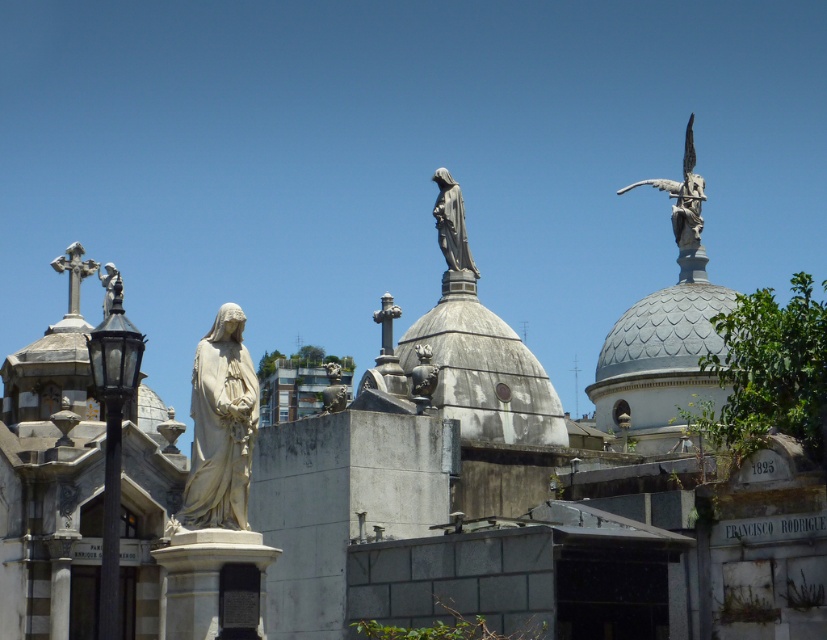
Question: Which point appears farthest from the camera in this image?

Choices:
 (A) (436, 224)
 (B) (244, 480)
 (C) (104, 317)

Answer: (A)

Question: From the image, what is the correct spatial relationship of white marble statue at center in relation to polished bronze angel at upper left?

Choices:
 (A) below
 (B) above

Answer: (A)

Question: Which of the following is the farthest from the observer?

Choices:
 (A) polished bronze angel at upper left
 (B) white marble statue at center

Answer: (B)

Question: Does polished stone cross at upper left have a smaller size compared to polished bronze angel at upper left?

Choices:
 (A) no
 (B) yes

Answer: (B)

Question: Which object appears farthest from the camera in this image?

Choices:
 (A) polished stone cross at upper left
 (B) polished bronze angel at upper left

Answer: (A)

Question: Does white marble statue at center appear on the right side of polished bronze statue at center?

Choices:
 (A) no
 (B) yes

Answer: (A)